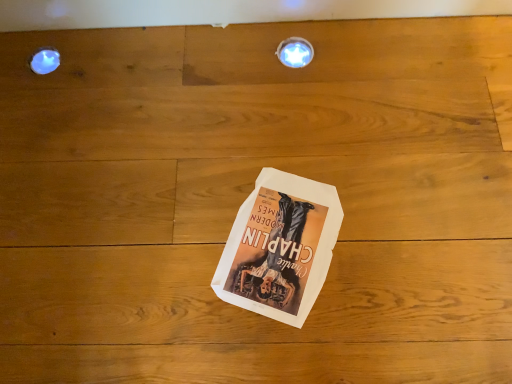
Locate an element on the screen. This screenshot has width=512, height=384. free space above white paper at center (from a real-world perspective) is located at coordinates (280, 236).